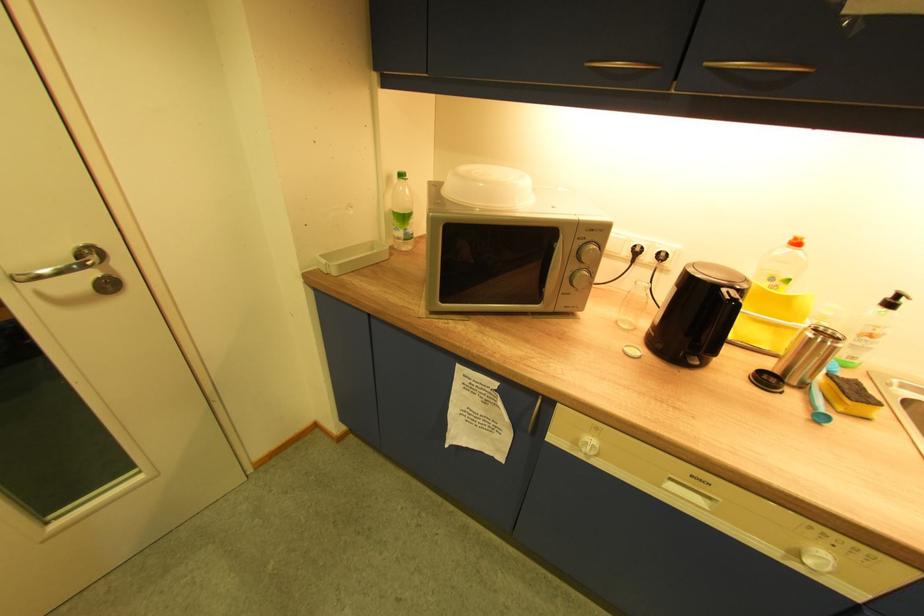
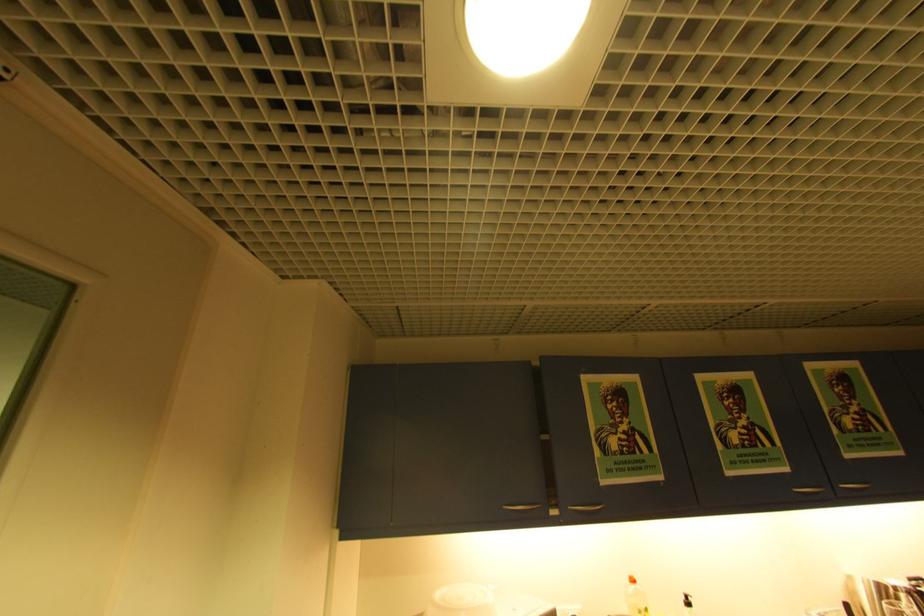
Find the pixel in the second image that matches point 797,238 in the first image.

(634, 578)